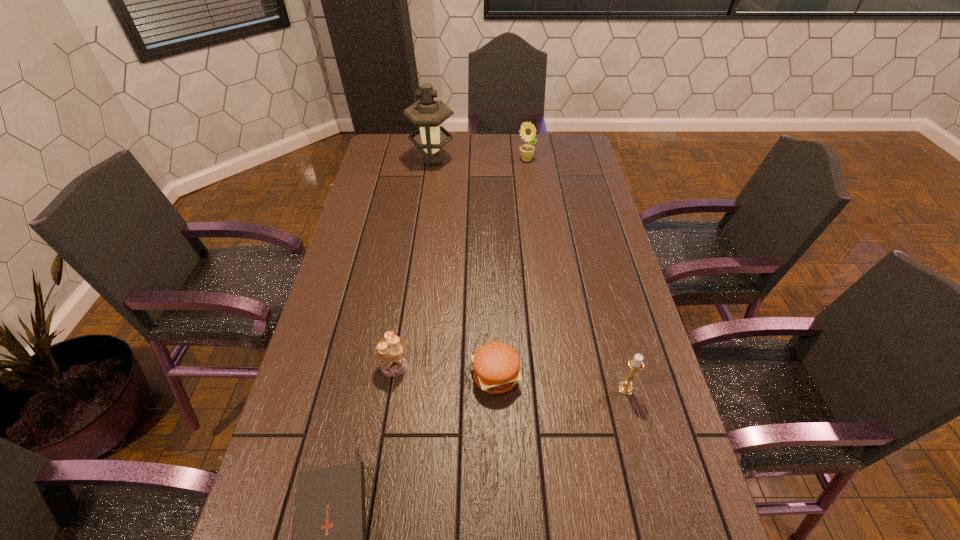
You are a GUI agent. You are given a task and a screenshot of the screen. Output one action in this format:
    pyautogui.click(x=<x>, y=<y>)
    Task: Click on the tallest object
    
    Given the screenshot: What is the action you would take?
    pyautogui.click(x=428, y=114)

This screenshot has height=540, width=960. I want to click on sunflower, so click(527, 130).

Identify the location of the left candle holder. This screenshot has height=540, width=960. 390,350.

The width and height of the screenshot is (960, 540). I want to click on the nearer candle holder, so click(x=625, y=387).

Where is `the rightmost object`? This screenshot has height=540, width=960. the rightmost object is located at coordinates (625, 387).

At what (x,y) coordinates should I click in order to perform the action: click on the second shortest object. Please return your answer as a coordinate pair (x, y). This screenshot has height=540, width=960. Looking at the image, I should click on (496, 365).

You are a GUI agent. You are given a task and a screenshot of the screen. Output one action in this format:
    pyautogui.click(x=<x>, y=<y>)
    Task: Click on the fourth object from left to right
    The image size is (960, 540).
    Given the screenshot: What is the action you would take?
    pyautogui.click(x=496, y=365)

You are a GUI agent. You are given a task and a screenshot of the screen. Output one action in this format:
    pyautogui.click(x=<x>, y=<y>)
    Task: Click on the vacant space located 0.260m on the front of the tallest object
    
    Given the screenshot: What is the action you would take?
    pyautogui.click(x=425, y=214)

Locate an element on the screen. The image size is (960, 540). vacant space located 0.300m on the face of the second object from right to left is located at coordinates (533, 210).

Where is `free space located 0.070m on the back of the farther candle holder`? The height and width of the screenshot is (540, 960). free space located 0.070m on the back of the farther candle holder is located at coordinates (399, 331).